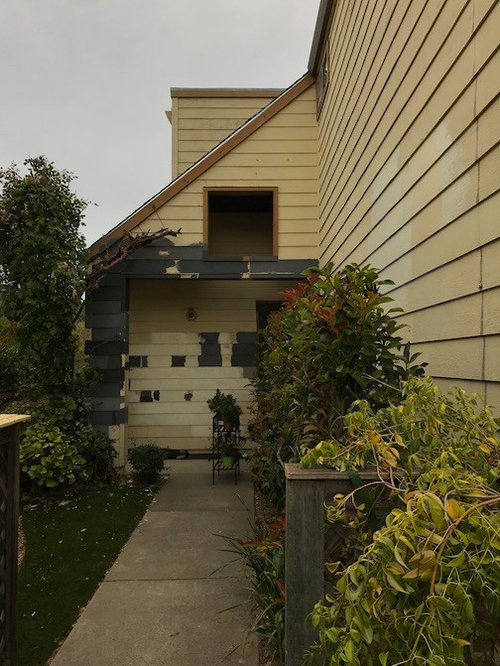
Identify the location of open window frame. tap(233, 220).